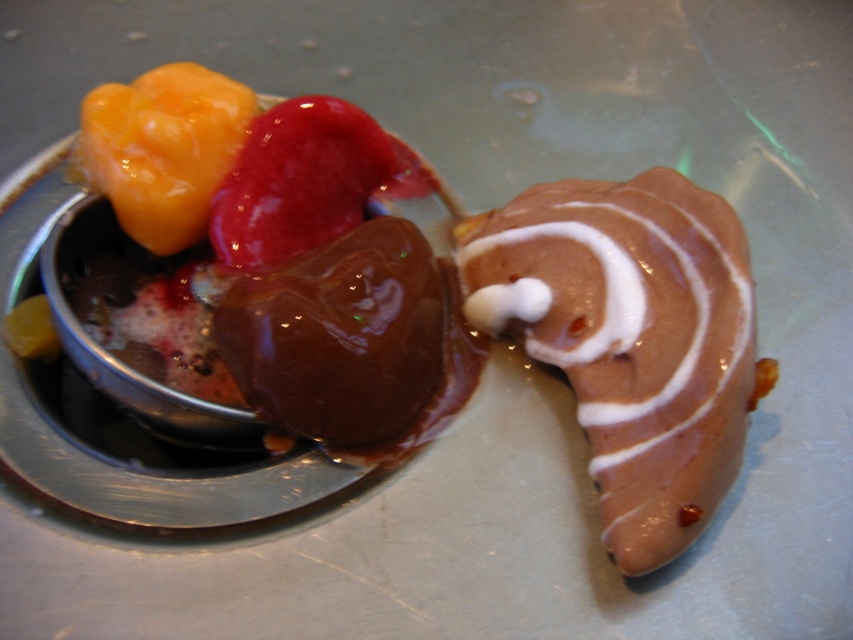
You are a food delivery person who needs to place a hot beverage on the table without touching the existing desserts. The beverage must be placed at least 10 cm away from the chocolate glaze donut at right. Where should you place it?

The chocolate glaze donut at right is located at point [630,339]. To ensure the beverage is placed at least 10 cm away, you should position it outside the 10 cm radius around this coordinate.

You are a dessert lover who wants to know which dessert is bigger between the chocolate glaze donut at right and the shiny red ice cream at center. Can you tell me which one is bigger?

The chocolate glaze donut at right is larger in size than the shiny red ice cream at center.